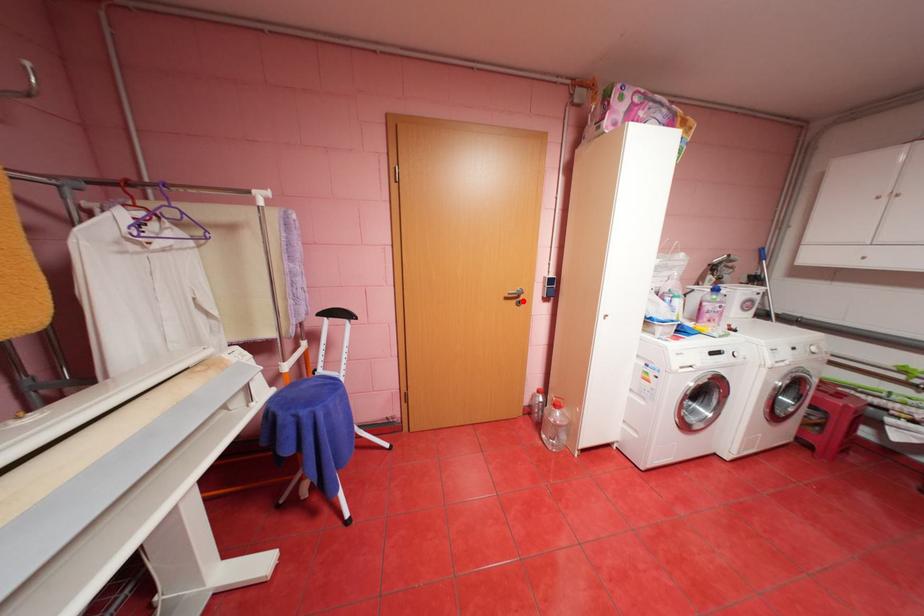
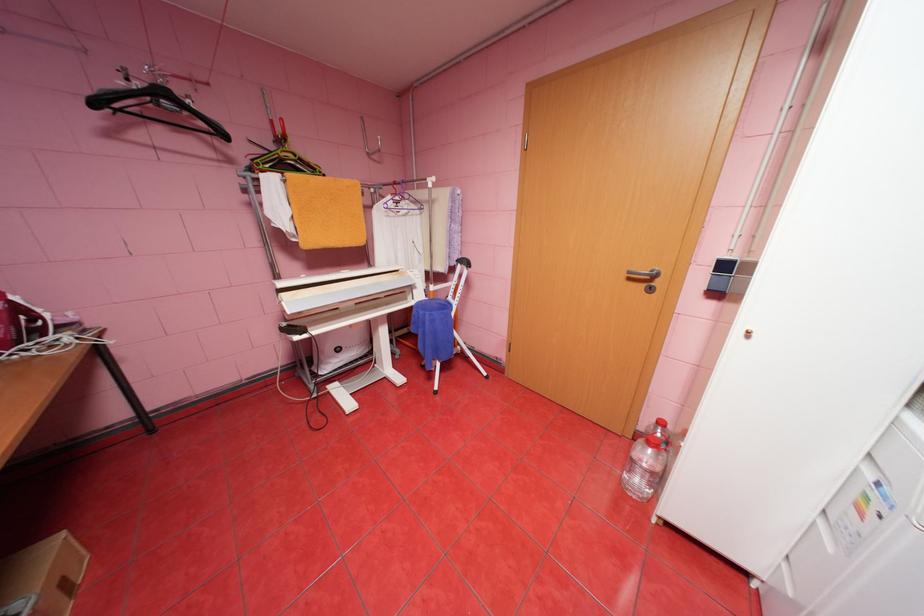
Find the pixel in the second image that matches the highlighted location in the first image.

(650, 285)